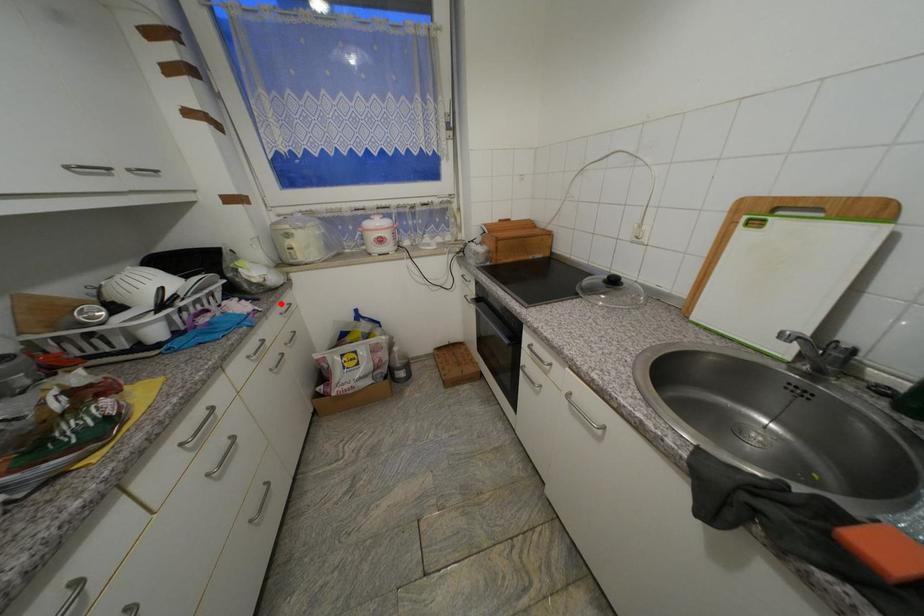
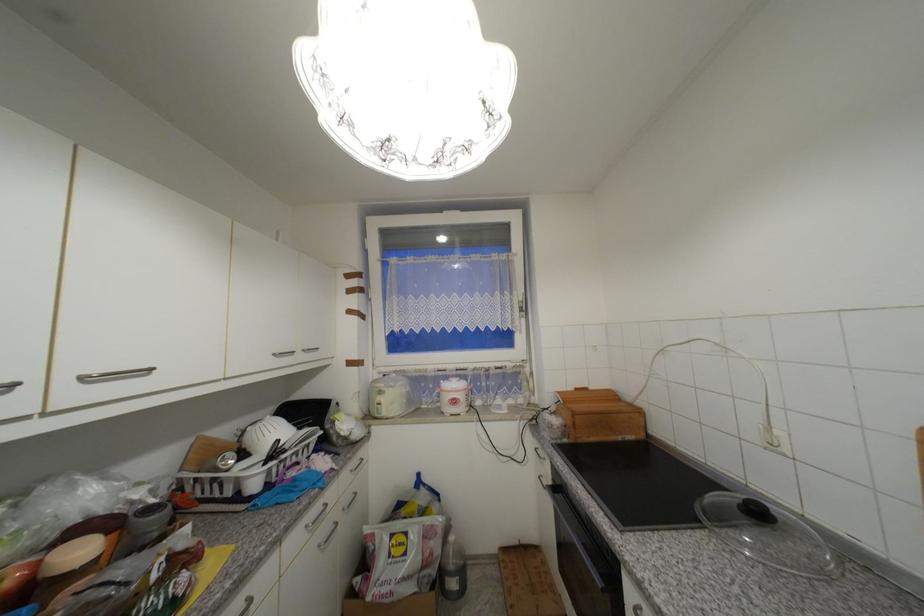
Question: I am providing you with two images of the same scene from different viewpoints. Image1 has a red point marked. In image2, the corresponding 3D location appears at what relative position? Reply with the corresponding letter.

Choices:
 (A) Closer
 (B) Farther

Answer: (B)